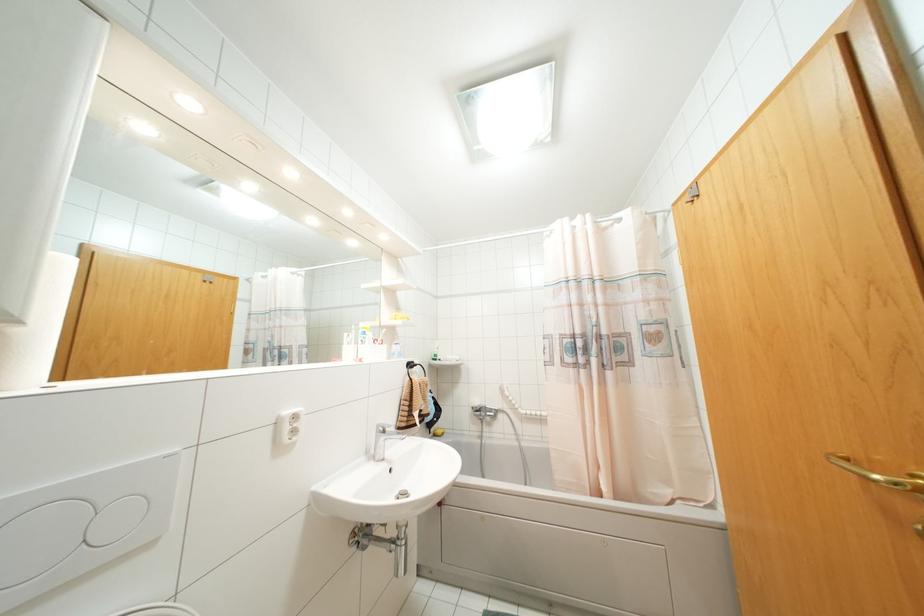
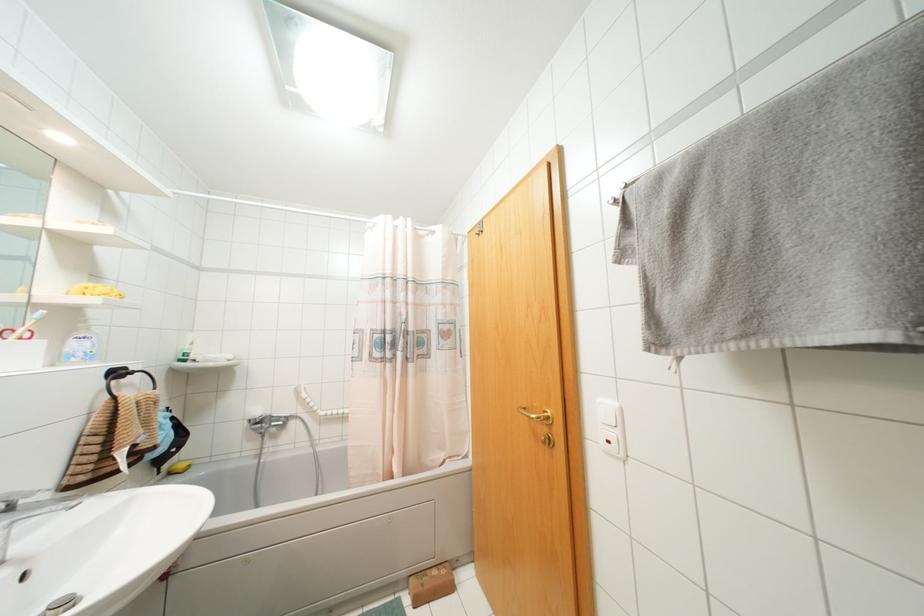
Question: I am providing you with two images of the same scene from different viewpoints. After the viewpoint changes to image2, which objects are now occluded?

Choices:
 (A) brass door handle
 (B) soap dispenser pump
 (C) sink drain plug
 (D) none of these

Answer: (D)